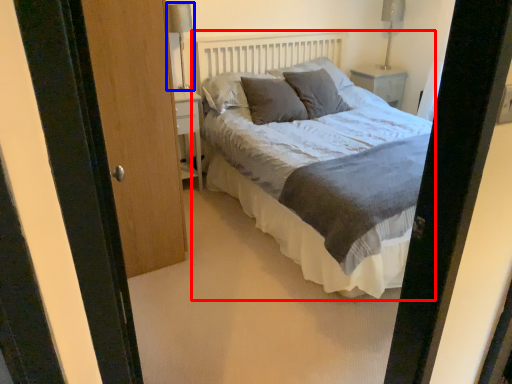
Question: Among these objects, which one is nearest to the camera, bed (highlighted by a red box) or table lamp (highlighted by a blue box)?

Choices:
 (A) bed
 (B) table lamp

Answer: (A)